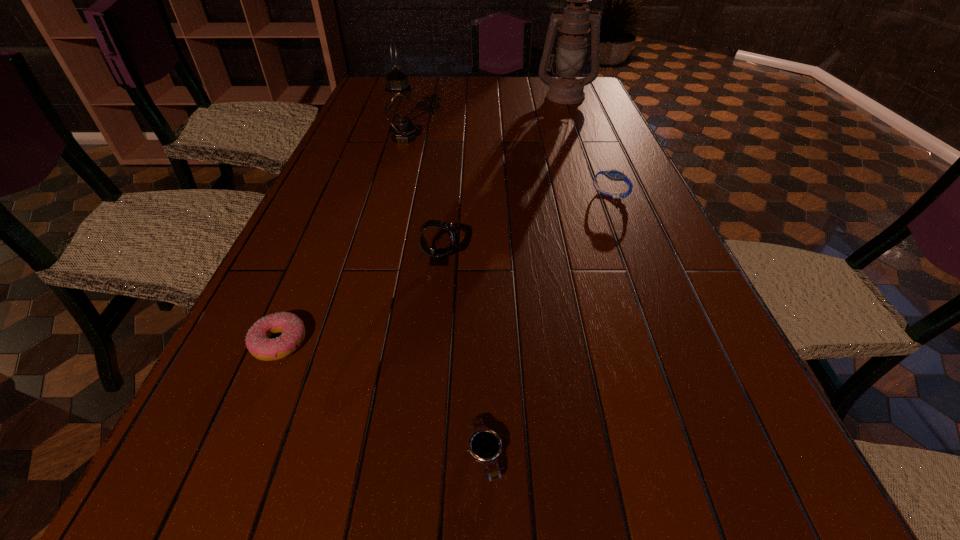
You are a GUI agent. You are given a task and a screenshot of the screen. Output one action in this format:
    pyautogui.click(x=<x>, y=<y>)
    Task: Click on the doughnut positioned at the left edge
    
    Given the screenshot: What is the action you would take?
    pyautogui.click(x=258, y=342)

Find the location of a particular element. oil lamp present at the right edge is located at coordinates (574, 23).

At what (x,y) coordinates should I click in order to perform the action: click on watch that is at the right edge. Please return your answer as a coordinate pair (x, y). The height and width of the screenshot is (540, 960). Looking at the image, I should click on (616, 175).

Locate an element on the screen. The image size is (960, 540). object located at the far right corner is located at coordinates (574, 23).

Identify the location of vacant region at the far edge of the desktop. The width and height of the screenshot is (960, 540). (476, 91).

Find the location of `vacant space at the left edge of the desktop`. vacant space at the left edge of the desktop is located at coordinates (337, 173).

The width and height of the screenshot is (960, 540). What are the coordinates of `empty space between the second tallest watch and the leftmost watch` in the screenshot? It's located at (525, 227).

Locate an element on the screen. vacant region between the farthest object and the rightmost watch is located at coordinates (588, 146).

You are a GUI agent. You are given a task and a screenshot of the screen. Output one action in this format:
    pyautogui.click(x=<x>, y=<y>)
    Task: Click on the empty space between the fifth tallest object and the third tallest object
    This screenshot has height=540, width=960.
    Given the screenshot: What is the action you would take?
    pyautogui.click(x=359, y=301)

What are the coordinates of `vacant space that's between the leftmost object and the nearest watch` in the screenshot? It's located at (382, 399).